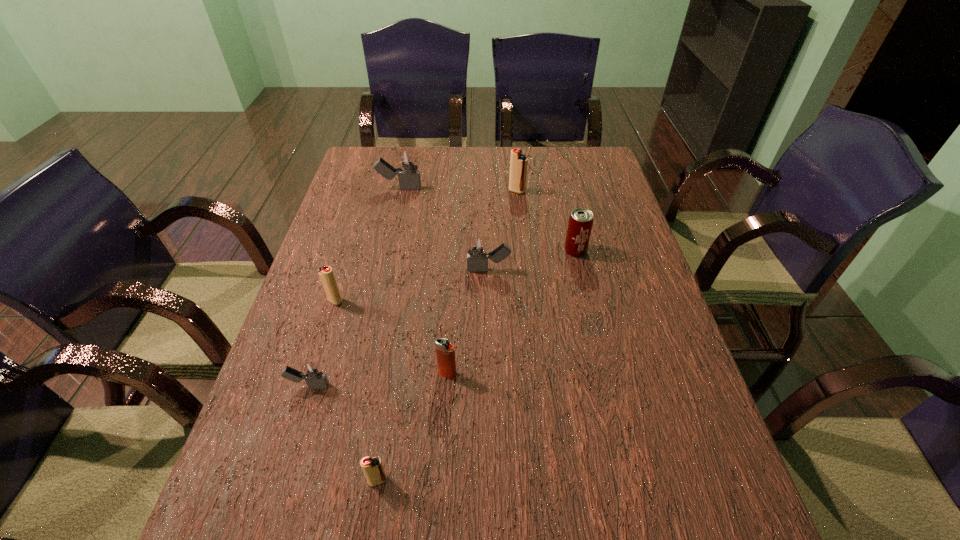
Find the location of `free space located 0.240m on the right of the nearest gray igniter`. free space located 0.240m on the right of the nearest gray igniter is located at coordinates (442, 386).

Locate an element on the screen. object located at the far edge is located at coordinates (409, 178).

This screenshot has height=540, width=960. I want to click on object that is at the right edge, so click(x=580, y=223).

Find the location of a particular element. Image resolution: width=960 pixels, height=540 pixels. object that is at the far left corner is located at coordinates (409, 178).

The image size is (960, 540). I want to click on vacant area at the far edge of the desktop, so click(494, 147).

Locate an element on the screen. The height and width of the screenshot is (540, 960). free space at the left edge is located at coordinates (286, 445).

Find the location of `free space at the right edge`. free space at the right edge is located at coordinates (612, 192).

At what (x,y) coordinates should I click in order to perform the action: click on free space between the nearest igniter and the fourth object from right to left. Please return your answer as a coordinate pair (x, y). This screenshot has height=540, width=960. Looking at the image, I should click on (413, 427).

Identify the location of free space between the rightmost igniter and the nearest red igniter. The height and width of the screenshot is (540, 960). (447, 336).

This screenshot has height=540, width=960. I want to click on vacant space in between the farthest gray igniter and the nearest object, so click(389, 334).